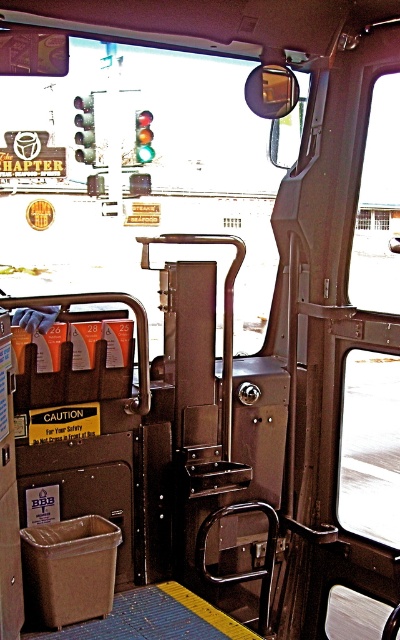
Question: Can you confirm if green glass traffic light at upper center is positioned to the left of glassy red traffic light at upper center?

Choices:
 (A) no
 (B) yes

Answer: (B)

Question: Among these objects, which one is farthest from the camera?

Choices:
 (A) glassy red traffic light at upper center
 (B) green glass traffic light at upper center

Answer: (A)

Question: Which point appears farthest from the camera in this image?

Choices:
 (A) (148, 115)
 (B) (82, 116)

Answer: (A)

Question: Does green glass traffic light at upper center appear under glassy red traffic light at upper center?

Choices:
 (A) yes
 (B) no

Answer: (B)

Question: Does green glass traffic light at upper center come in front of glassy red traffic light at upper center?

Choices:
 (A) yes
 (B) no

Answer: (A)

Question: Which of the following is the closest to the observer?

Choices:
 (A) (146, 154)
 (B) (76, 104)

Answer: (B)